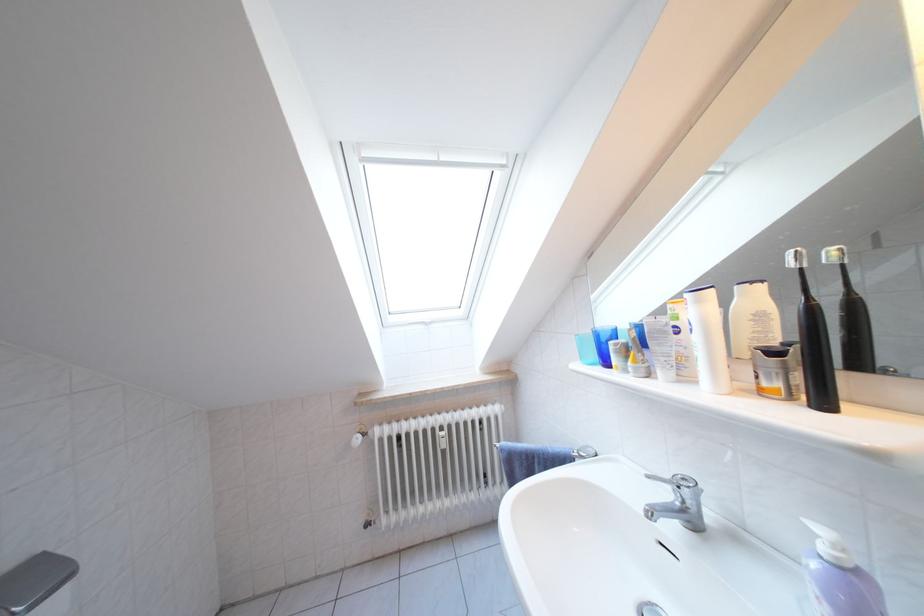
What do you see at coordinates (359, 436) in the screenshot? This screenshot has height=616, width=924. I see `a white radiator knob` at bounding box center [359, 436].